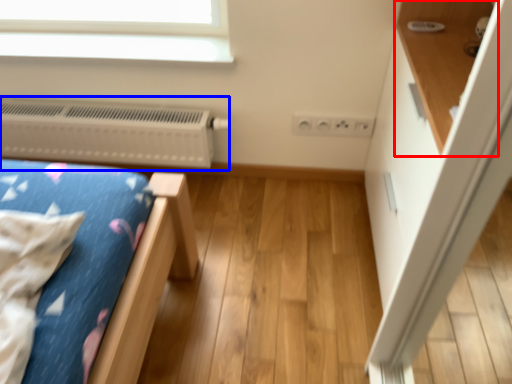
Question: Among these objects, which one is nearest to the camera, shelf (highlighted by a red box) or heater (highlighted by a blue box)?

Choices:
 (A) shelf
 (B) heater

Answer: (A)